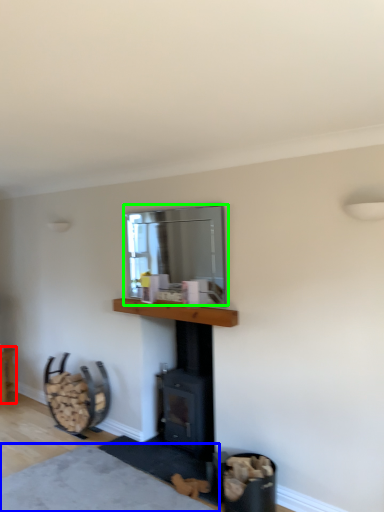
Question: Estimate the real-world distances between objects in this image. Which object is closer to furniture (highlighted by a red box), plain (highlighted by a blue box) or window screen (highlighted by a green box)?

Choices:
 (A) plain
 (B) window screen

Answer: (A)